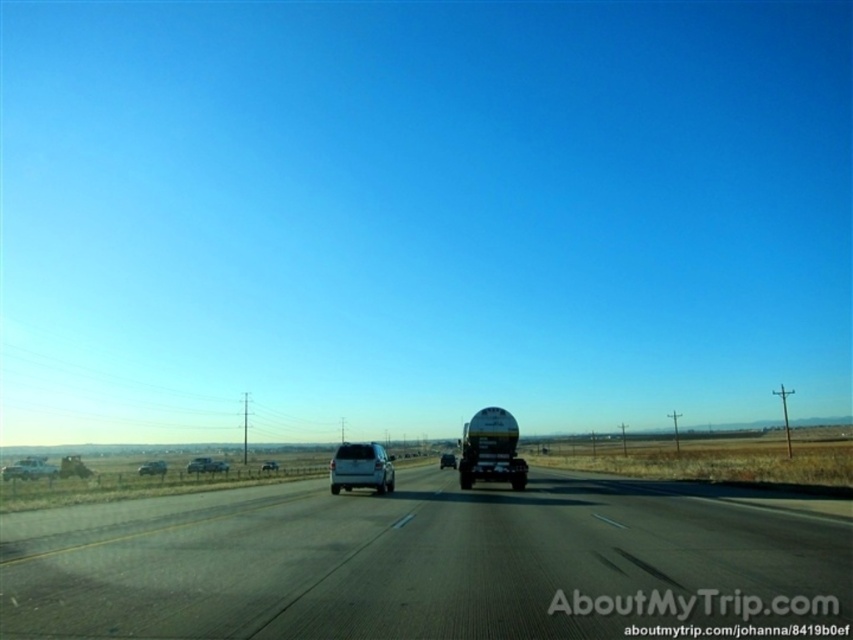
You are a driver approaching the highway and see the point marked at coordinates (152,467). What vehicle is located at that point?

The point at coordinates (152,467) indicates a silver metallic sedan at lower left.

You are a driver approaching the highway. You see a point marked at coordinates [422,561]. What does this point represent?

The point at coordinates [422,561] represents the black asphalt highway at center.

You are a driver in a car that is 1.8 meters wide. You need to park your car in a parking spot that can only accommodate vehicles up to 1.7 meters wide. You see the silver metallic suv at lower left and the white matte suv at center in the scene. Which SUV can you use as a reference to determine if your car will fit in the parking spot?

The silver metallic suv at lower left is wider than the white matte suv at center. Since your car is 1.8 meters wide and the parking spot allows up to 1.7 meters, the white matte suv at center is narrower and can serve as a reference that your car may not fit, but the silver metallic suv at lower left is even wider, so it would not fit either. However, since the parking spot has a width limit, neither SUV would be suitable references for fitting your car.